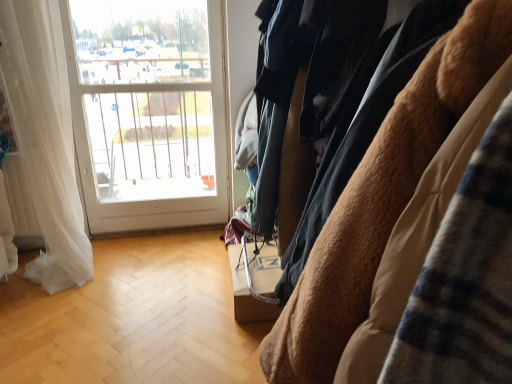
What do you see at coordinates (148, 111) in the screenshot?
I see `white glass window at upper left` at bounding box center [148, 111].

Measure the distance between point (x=64, y=228) and camera.

The distance of point (x=64, y=228) from camera is 2.37 meters.

Where is `white sheer curtain at left`? The image size is (512, 384). white sheer curtain at left is located at coordinates (45, 138).

Where is `white glass window at upper left`? The width and height of the screenshot is (512, 384). white glass window at upper left is located at coordinates (148, 111).

From the image's perspective, is white glass window at upper left located beneath brown fuzzy coat at right?

No, from the image's perspective, white glass window at upper left is not beneath brown fuzzy coat at right.

Which object is positioned more to the right, white glass window at upper left or brown fuzzy coat at right?

brown fuzzy coat at right is more to the right.

Which is in front, white glass window at upper left or brown fuzzy coat at right?

brown fuzzy coat at right is in front.

Is brown fuzzy coat at right placed right next to white sheer curtain at left?

They are not placed beside each other.

Based on the photo, does brown fuzzy coat at right have a larger size compared to white sheer curtain at left?

Yes.

In the scene shown: Is brown fuzzy coat at right at the left side of white sheer curtain at left?

No.

Does point (450, 104) appear closer or farther from the camera than point (33, 42)?

Clearly, point (450, 104) is closer to the camera than point (33, 42).

Does white glass window at upper left have a greater width compared to white sheer curtain at left?

In fact, white glass window at upper left might be narrower than white sheer curtain at left.

Between white glass window at upper left and white sheer curtain at left, which one appears on the left side from the viewer's perspective?

white sheer curtain at left is more to the left.

Considering the points (223, 61) and (72, 243), which point is behind, point (223, 61) or point (72, 243)?

The point (223, 61) is farther.

How far apart are brown fuzzy coat at right and white glass window at upper left?

A distance of 7.30 feet exists between brown fuzzy coat at right and white glass window at upper left.

Between brown fuzzy coat at right and white glass window at upper left, which one is positioned in front?

brown fuzzy coat at right.

Can we say brown fuzzy coat at right lies outside white glass window at upper left?

Yes, brown fuzzy coat at right is outside of white glass window at upper left.

Does point (374, 245) appear closer or farther from the camera than point (198, 148)?

Point (374, 245) is closer to the camera than point (198, 148).

From the image's perspective, is white sheer curtain at left on top of white glass window at upper left?

No.

What's the angular difference between white sheer curtain at left and white glass window at upper left's facing directions?

The angle between the facing direction of white sheer curtain at left and the facing direction of white glass window at upper left is 0.477 degrees.

Is white sheer curtain at left taller or shorter than white glass window at upper left?

white sheer curtain at left is shorter than white glass window at upper left.

Which of these two, white sheer curtain at left or brown fuzzy coat at right, is smaller?

With smaller size is white sheer curtain at left.

Is point (79, 205) farther from viewer compared to point (323, 309)?

Yes, point (79, 205) is behind point (323, 309).

Locate an element on the screen. Image resolution: width=512 pixels, height=384 pixels. curtain on the left of brown fuzzy coat at right is located at coordinates (45, 138).

Is white sheer curtain at left not inside brown fuzzy coat at right?

Indeed, white sheer curtain at left is completely outside brown fuzzy coat at right.

Identify the location of window lying above the brown fuzzy coat at right (from the image's perspective). (148, 111).

Where is `furniture lying on the right of white sheer curtain at left`? The height and width of the screenshot is (384, 512). furniture lying on the right of white sheer curtain at left is located at coordinates (382, 198).

Looking at the image, which one is located closer to white sheer curtain at left, brown fuzzy coat at right or white glass window at upper left?

Based on the image, white glass window at upper left appears to be nearer to white sheer curtain at left.

Based on their spatial positions, is white sheer curtain at left or brown fuzzy coat at right closer to white glass window at upper left?

white sheer curtain at left lies closer to white glass window at upper left than the other object.

Looking at the image, which one is located closer to white sheer curtain at left, white glass window at upper left or brown fuzzy coat at right?

white glass window at upper left is closer to white sheer curtain at left.

Consider the image. Estimate the real-world distances between objects in this image. Which object is closer to brown fuzzy coat at right, white glass window at upper left or white sheer curtain at left?

Based on the image, white sheer curtain at left appears to be nearer to brown fuzzy coat at right.

Consider the image. Which object lies further to the anchor point brown fuzzy coat at right, white sheer curtain at left or white glass window at upper left?

Based on the image, white glass window at upper left appears to be further to brown fuzzy coat at right.

Based on their spatial positions, is brown fuzzy coat at right or white sheer curtain at left closer to white glass window at upper left?

Among the two, white sheer curtain at left is located nearer to white glass window at upper left.

Where is `curtain between brown fuzzy coat at right and white glass window at upper left along the z-axis`? Image resolution: width=512 pixels, height=384 pixels. curtain between brown fuzzy coat at right and white glass window at upper left along the z-axis is located at coordinates [x=45, y=138].